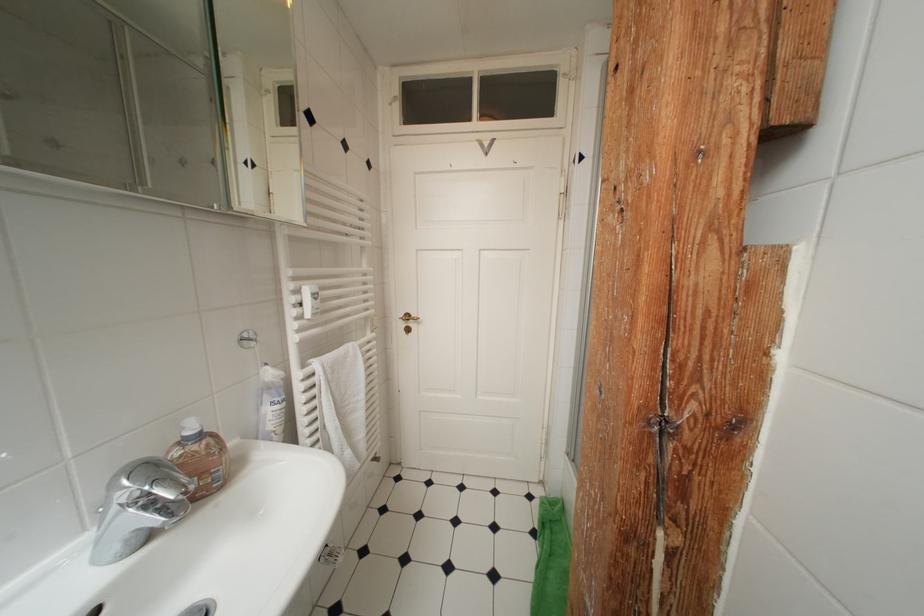
The image size is (924, 616). What are the coordinates of `radiator control knob` in the screenshot? It's located at (304, 302).